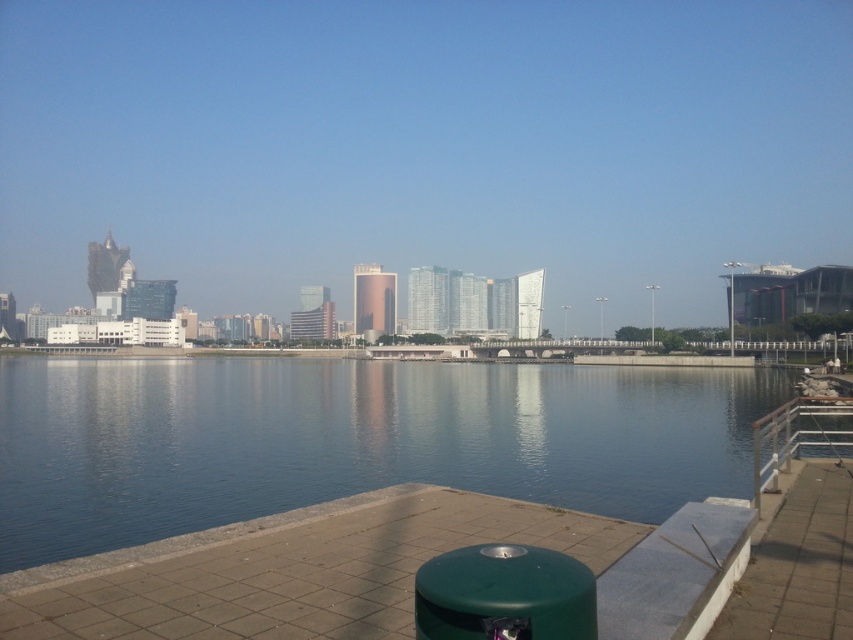
Question: Observing the image, what is the correct spatial positioning of blue glassy water at center in reference to silver metallic railing at lower right?

Choices:
 (A) right
 (B) left

Answer: (B)

Question: Can you confirm if blue glassy water at center is positioned above silver metallic railing at lower right?

Choices:
 (A) no
 (B) yes

Answer: (A)

Question: Does blue glassy water at center appear over silver metallic railing at lower right?

Choices:
 (A) no
 (B) yes

Answer: (A)

Question: Among these objects, which one is nearest to the camera?

Choices:
 (A) silver metallic railing at lower right
 (B) blue glassy water at center

Answer: (B)

Question: Which point is farther to the camera?

Choices:
 (A) (833, 401)
 (B) (192, 461)

Answer: (B)

Question: Among these points, which one is farthest from the camera?

Choices:
 (A) (788, 422)
 (B) (106, 540)

Answer: (A)